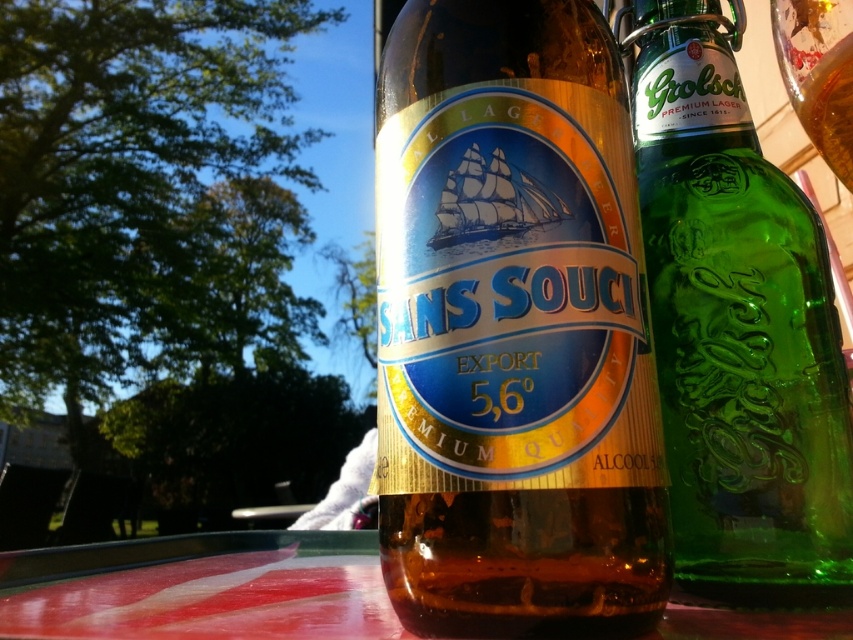
Question: Which point is closer to the camera?

Choices:
 (A) smooth glossy table at center
 (B) brown glass bottle at center
 (C) green glass bottle at right
 (D) transparent glass at upper right

Answer: (D)

Question: Which of the following is the closest to the observer?

Choices:
 (A) (805, 627)
 (B) (808, 81)

Answer: (B)

Question: Is green glass bottle at right further to camera compared to transparent glass at upper right?

Choices:
 (A) yes
 (B) no

Answer: (A)

Question: Can you confirm if brown glass bottle at center is positioned above smooth glossy table at center?

Choices:
 (A) no
 (B) yes

Answer: (B)

Question: Is brown glass bottle at center bigger than smooth glossy table at center?

Choices:
 (A) no
 (B) yes

Answer: (A)

Question: Among these objects, which one is nearest to the camera?

Choices:
 (A) smooth glossy table at center
 (B) transparent glass at upper right

Answer: (B)